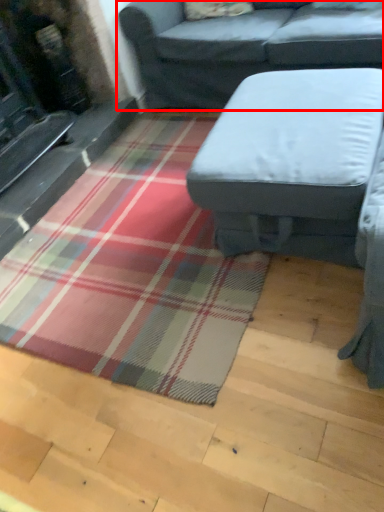
Question: Observing the image, what is the correct spatial positioning of studio couch (annotated by the red box) in reference to studio couch?

Choices:
 (A) right
 (B) left

Answer: (A)